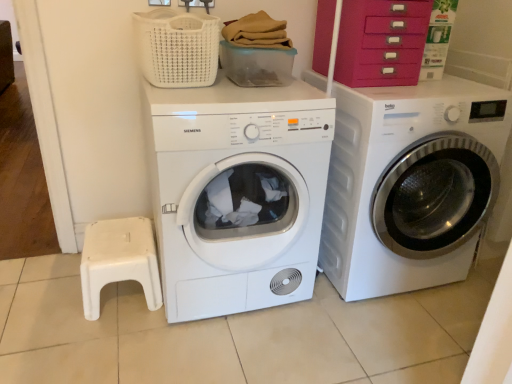
Question: From the image's perspective, is white glossy washing machine at right, which appears as the 1th washing machine when viewed from the right, on top of white woven basket at upper center?

Choices:
 (A) no
 (B) yes

Answer: (A)

Question: Can you confirm if white glossy washing machine at right, placed as the 2th washing machine when sorted from left to right, is bigger than white woven basket at upper center?

Choices:
 (A) yes
 (B) no

Answer: (A)

Question: From a real-world perspective, is white glossy washing machine at right, placed as the 2th washing machine when sorted from left to right, physically below white woven basket at upper center?

Choices:
 (A) no
 (B) yes

Answer: (B)

Question: Is white glossy washing machine at right, which appears as the 1th washing machine when viewed from the right, oriented away from white woven basket at upper center?

Choices:
 (A) yes
 (B) no

Answer: (B)

Question: Is white glossy washing machine at right, placed as the 2th washing machine when sorted from left to right, touching white woven basket at upper center?

Choices:
 (A) no
 (B) yes

Answer: (A)

Question: Can you confirm if white glossy washing machine at right, which appears as the 1th washing machine when viewed from the right, is smaller than white woven basket at upper center?

Choices:
 (A) no
 (B) yes

Answer: (A)

Question: Is velvet pink drawer at upper right smaller than white plastic step stool at lower left?

Choices:
 (A) yes
 (B) no

Answer: (B)

Question: From the image's perspective, is velvet pink drawer at upper right on white plastic step stool at lower left?

Choices:
 (A) yes
 (B) no

Answer: (A)

Question: Is white plastic step stool at lower left surrounded by velvet pink drawer at upper right?

Choices:
 (A) yes
 (B) no

Answer: (B)

Question: Can you confirm if velvet pink drawer at upper right is positioned to the left of white plastic step stool at lower left?

Choices:
 (A) yes
 (B) no

Answer: (B)

Question: Does velvet pink drawer at upper right have a lesser width compared to white plastic step stool at lower left?

Choices:
 (A) yes
 (B) no

Answer: (A)

Question: Is velvet pink drawer at upper right shorter than white plastic step stool at lower left?

Choices:
 (A) no
 (B) yes

Answer: (A)

Question: Is white plastic step stool at lower left positioned behind white glossy washing machine at right, which appears as the 1th washing machine when viewed from the right?

Choices:
 (A) no
 (B) yes

Answer: (B)